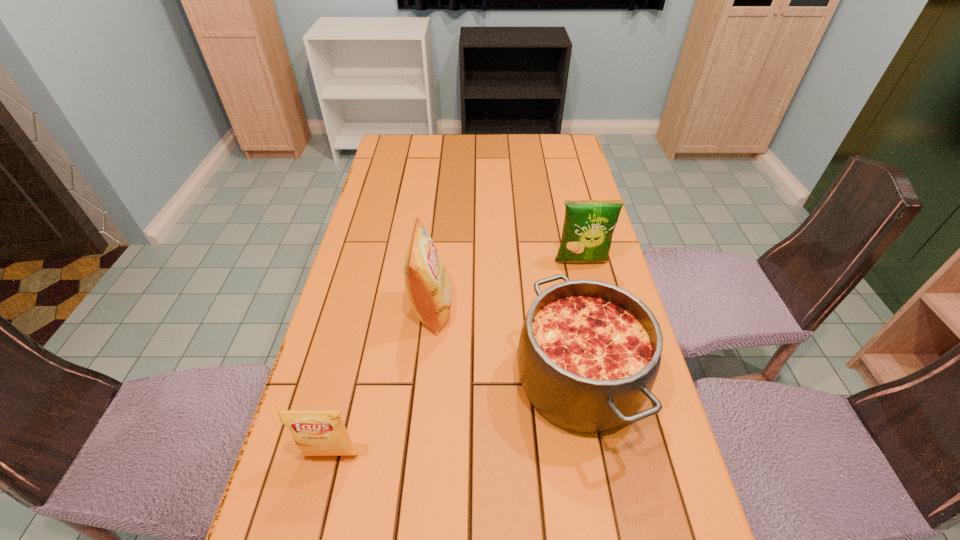
Where is `free location that satisfies the following two spatial constraints: 1. on the front-facing side of the second object from left to right; 2. on the back side of the casserole`? The height and width of the screenshot is (540, 960). free location that satisfies the following two spatial constraints: 1. on the front-facing side of the second object from left to right; 2. on the back side of the casserole is located at coordinates (425, 381).

The width and height of the screenshot is (960, 540). I want to click on free spot that satisfies the following two spatial constraints: 1. on the front-facing side of the farthest object; 2. on the front-facing side of the second crisp (potato chip) from right to left, so click(x=592, y=309).

You are a GUI agent. You are given a task and a screenshot of the screen. Output one action in this format:
    pyautogui.click(x=<x>, y=<y>)
    Task: Click on the blank space that satisfies the following two spatial constraints: 1. on the front-facing side of the second nearest crisp (potato chip); 2. on the front of the leftmost object with the logo
    The width and height of the screenshot is (960, 540).
    Given the screenshot: What is the action you would take?
    pyautogui.click(x=418, y=455)

Find the location of a particular element. vacant space that satisfies the following two spatial constraints: 1. on the front-facing side of the second nearest crisp (potato chip); 2. on the front of the shortest crisp (potato chip) with the logo is located at coordinates (418, 455).